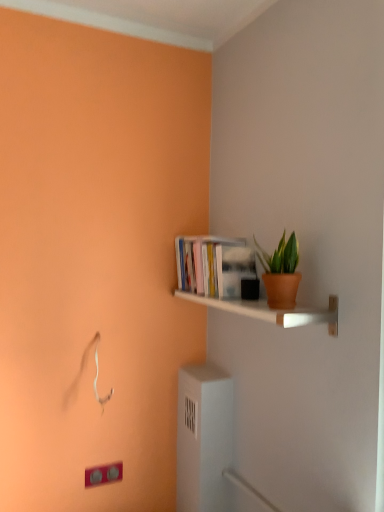
Question: Looking at their shapes, would you say white glossy shelf at upper right is wider or thinner than hardcover books at upper right?

Choices:
 (A) wide
 (B) thin

Answer: (A)

Question: From the image's perspective, is white glossy shelf at upper right above or below hardcover books at upper right?

Choices:
 (A) above
 (B) below

Answer: (B)

Question: Which object is the farthest from the matte white light switch at lower left?

Choices:
 (A) white glossy shelf at upper right
 (B) hardcover books at upper right
 (C) terracotta clay pot at upper right

Answer: (C)

Question: Considering the real-world distances, which object is farthest from the terracotta clay pot at upper right?

Choices:
 (A) hardcover books at upper right
 (B) matte white light switch at lower left
 (C) white glossy shelf at upper right

Answer: (B)